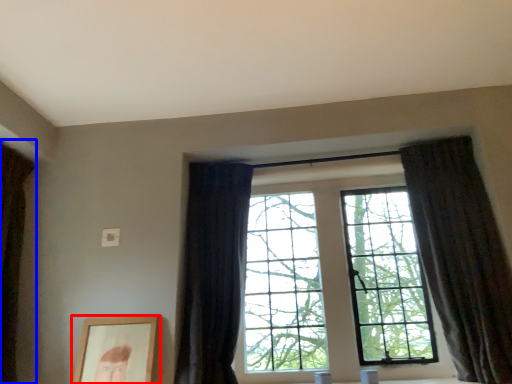
Question: Among these objects, which one is farthest to the camera, picture frame (highlighted by a red box) or curtain (highlighted by a blue box)?

Choices:
 (A) picture frame
 (B) curtain

Answer: (A)